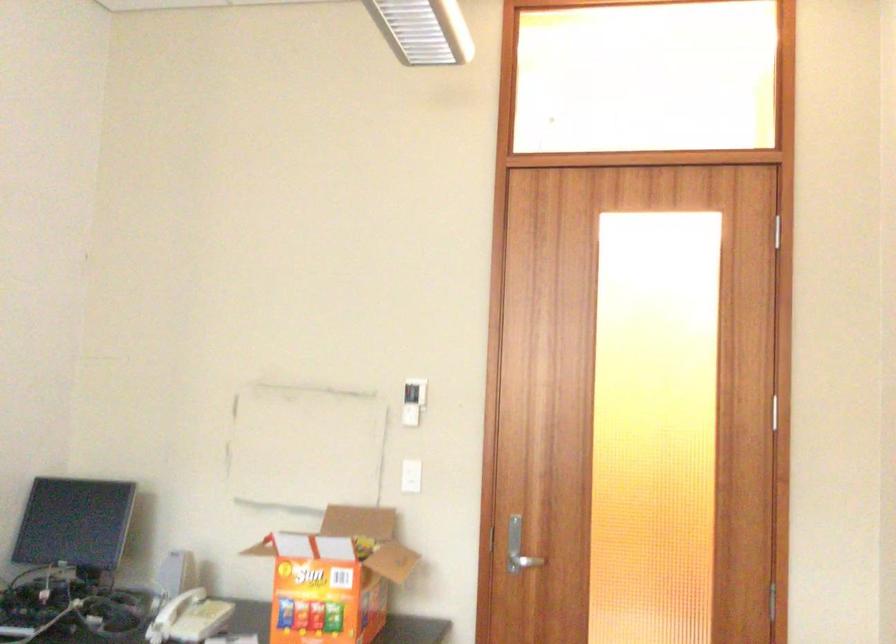
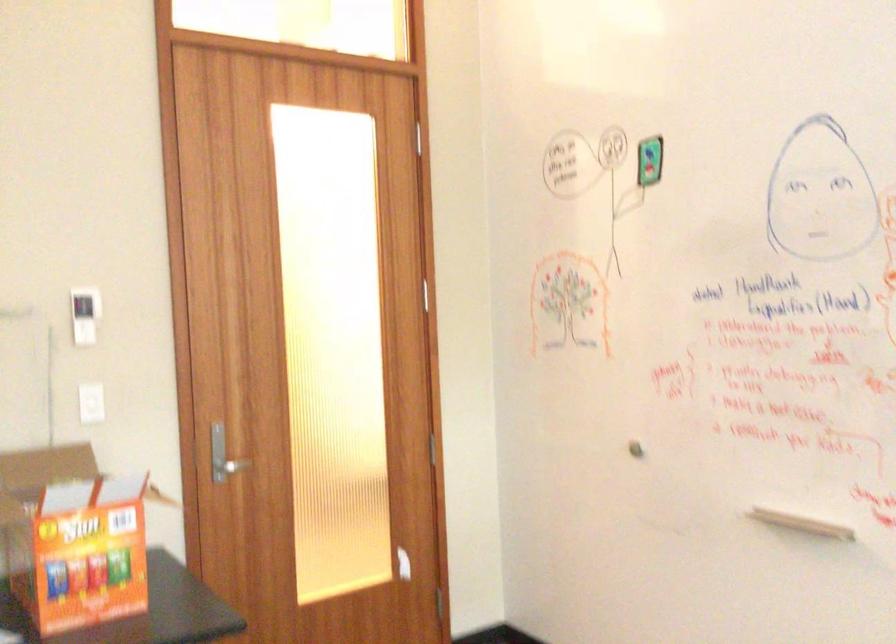
Locate, in the second image, the point that corresponds to the point at 517,562 in the first image.

(226, 466)